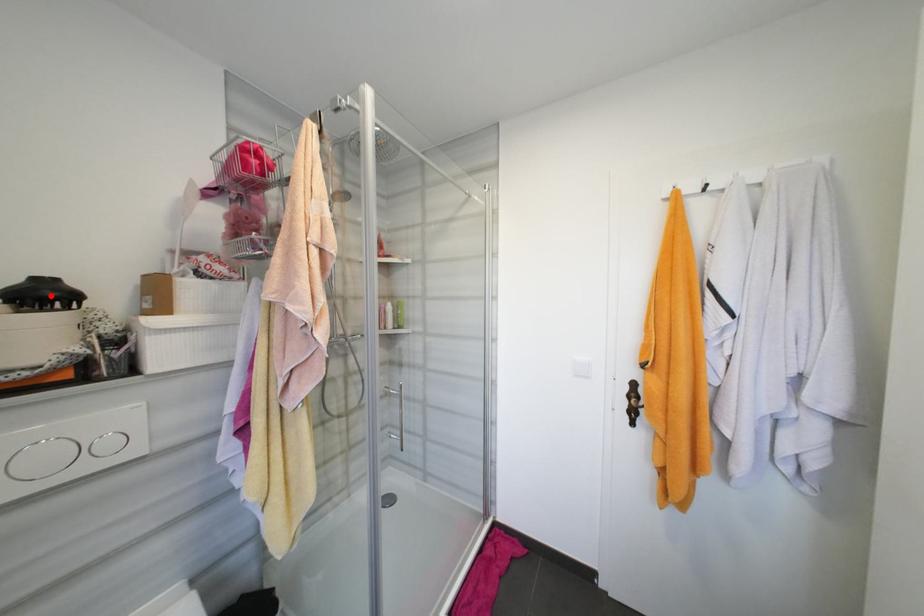
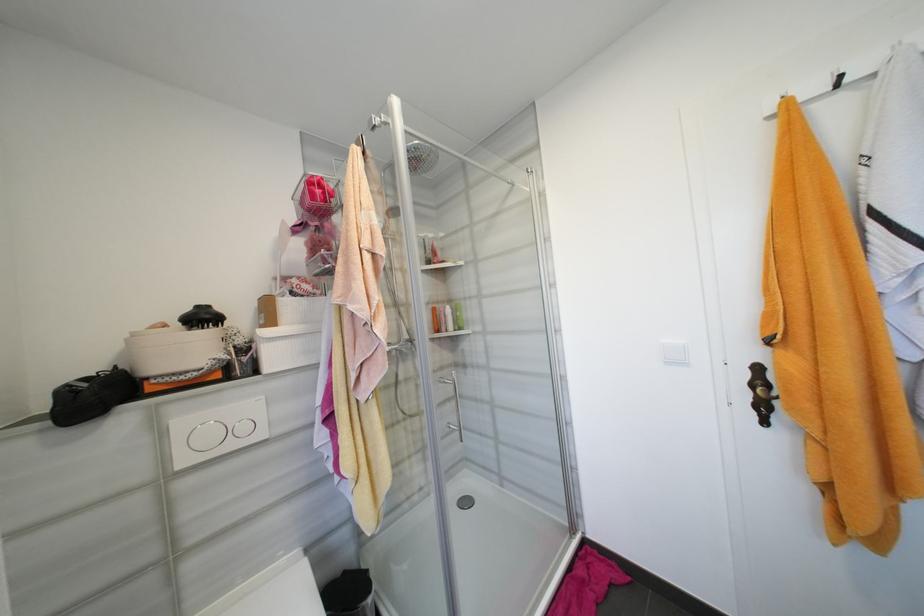
Where in the second image is the point corresponding to the highlighted location from the first image?

(210, 318)